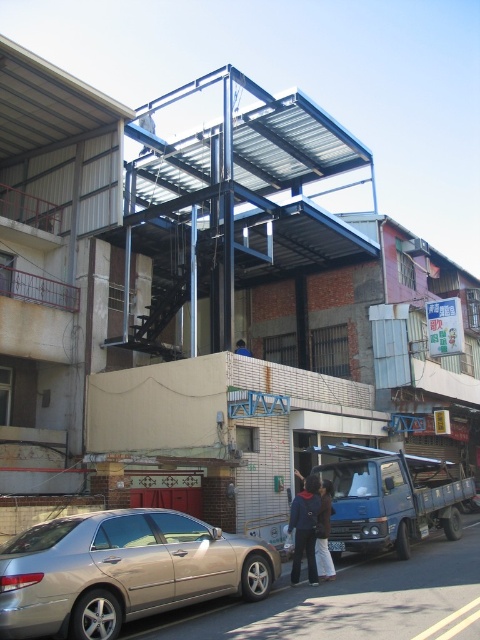
You are standing at the center of the scene and want to move towards the gold metallic car at lower left. Which direction should you move in?

The gold metallic car at lower left is located at point 0.892 on the x axis and 0.256 on the y axis, so you should move towards the lower left direction to reach it.

You are a pedestrian standing on the sidewalk and see the gold metallic car at lower left and the dark brown leather jacket at center. Which object is closer to the left side of the image?

The gold metallic car at lower left is to the left of the dark brown leather jacket at center, so it is closer to the left side of the image.